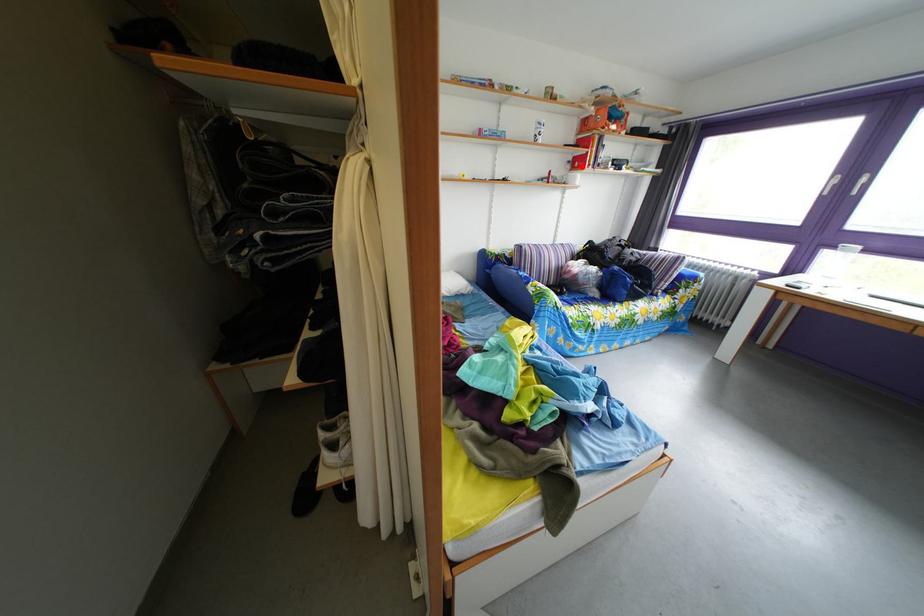
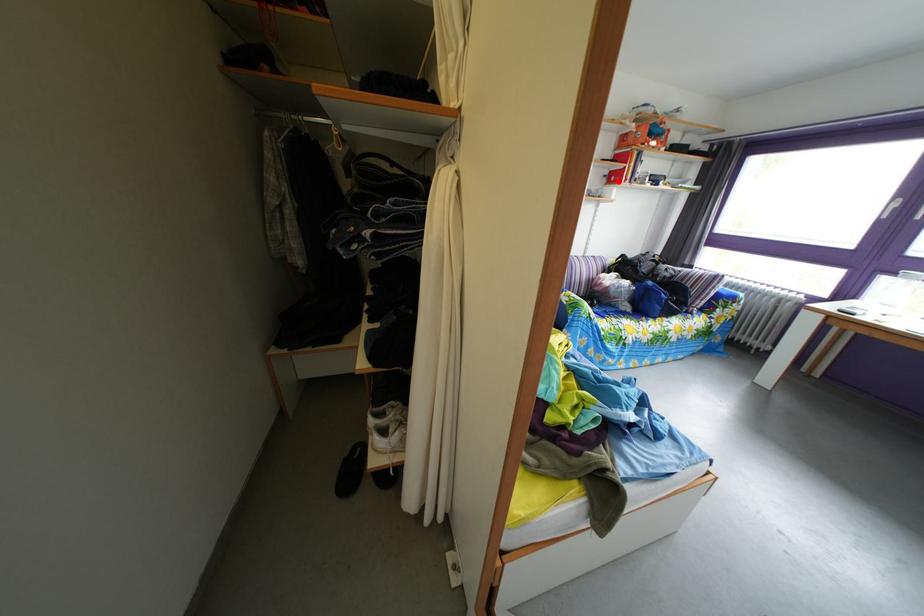
I am providing you with two images of the same scene from different viewpoints. A red point is marked on the first image and another point is marked on the second image. Is the marked point in image1 the same physical position as the marked point in image2?

Yes